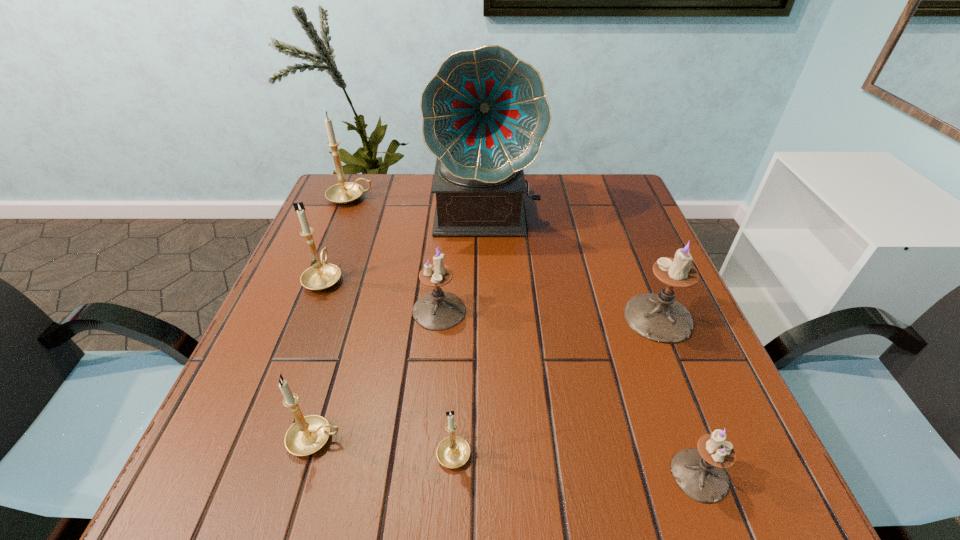
This screenshot has width=960, height=540. In order to click on record player in this screenshot , I will do `click(485, 114)`.

This screenshot has width=960, height=540. Identify the location of the farthest candle holder. (345, 192).

Find the location of a particular element. The width and height of the screenshot is (960, 540). the farthest gold candle holder is located at coordinates (345, 192).

Identify the location of the second farthest gold candle holder. The image size is (960, 540). (322, 275).

Where is `the biggest purple candle holder`? Image resolution: width=960 pixels, height=540 pixels. the biggest purple candle holder is located at coordinates (659, 317).

Where is `the leftmost purple candle holder`? the leftmost purple candle holder is located at coordinates (439, 310).

Identify the location of the second smallest gold candle holder. 307,435.

The height and width of the screenshot is (540, 960). I want to click on the smallest gold candle holder, so click(452, 452).

This screenshot has height=540, width=960. Find the location of `the nearest purple candle holder`. the nearest purple candle holder is located at coordinates (699, 473).

The height and width of the screenshot is (540, 960). In order to click on blank area located 0.310m on the horn of the tallest object in this screenshot , I will do `click(488, 343)`.